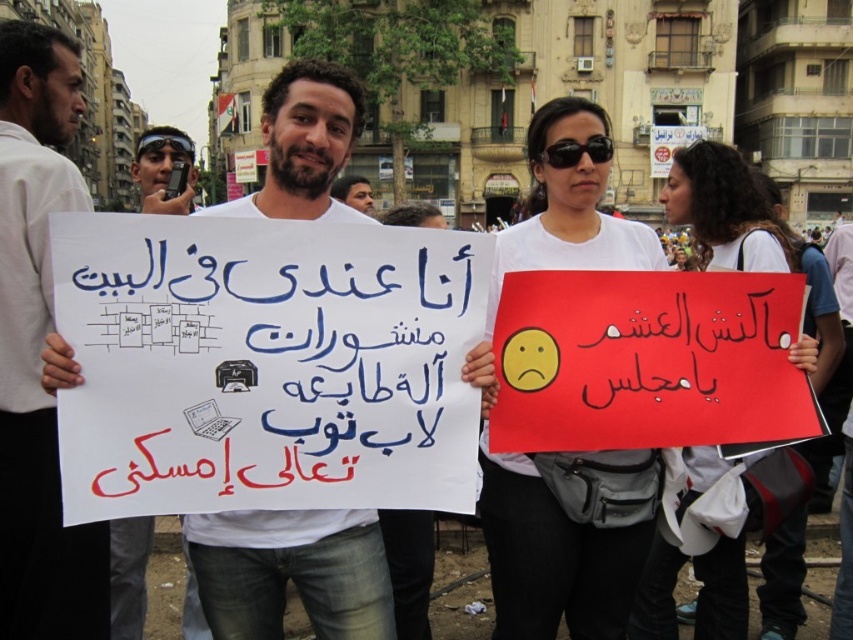
Who is positioned more to the left, white paper sign at center or black paper at center?

From the viewer's perspective, white paper sign at center appears more on the left side.

Can you confirm if white paper sign at center is taller than black paper at center?

Yes, white paper sign at center is taller than black paper at center.

Locate an element on the screen. The image size is (853, 640). white paper sign at center is located at coordinates (291, 572).

Does black paper at center appear over dark brown hair at center?

No.

Measure the distance between black paper at center and camera.

A distance of 30.66 meters exists between black paper at center and camera.

Identify the location of black paper at center. (685, 342).

Image resolution: width=853 pixels, height=640 pixels. Identify the location of black paper at center. (685, 342).

Identify the location of white paper sign at center. The height and width of the screenshot is (640, 853). (291, 572).

Identify the location of white paper sign at center. The image size is (853, 640). (291, 572).